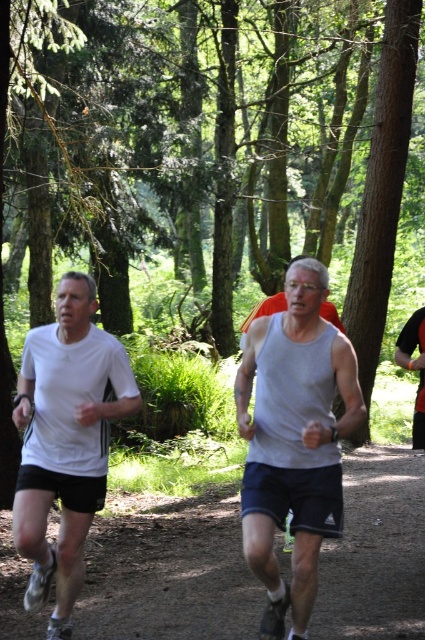
Consider the image. Between gray matte tank top at center and white matte t-shirt at left, which one has less height?

With less height is gray matte tank top at center.

Describe the element at coordinates (294, 438) in the screenshot. Image resolution: width=425 pixels, height=640 pixels. I see `gray matte tank top at center` at that location.

Image resolution: width=425 pixels, height=640 pixels. Identify the location of gray matte tank top at center. (294, 438).

Where is `gray matte tank top at center`? This screenshot has height=640, width=425. gray matte tank top at center is located at coordinates (294, 438).

Does gray matte tank top at center appear on the right side of black mesh tank top at right?

Incorrect, gray matte tank top at center is not on the right side of black mesh tank top at right.

Is gray matte tank top at center closer to the viewer compared to black mesh tank top at right?

Yes, it is.

Where is `gray matte tank top at center`? This screenshot has height=640, width=425. gray matte tank top at center is located at coordinates (294, 438).

This screenshot has height=640, width=425. In order to click on gray matte tank top at center in this screenshot , I will do `click(294, 438)`.

Is point (28, 600) positioned after point (413, 314)?

No, it is not.

Between white matte t-shirt at left and black mesh tank top at right, which one appears on the left side from the viewer's perspective?

white matte t-shirt at left

Locate an element on the screen. white matte t-shirt at left is located at coordinates (65, 440).

Identify the location of white matte t-shirt at left. This screenshot has width=425, height=640. (65, 440).